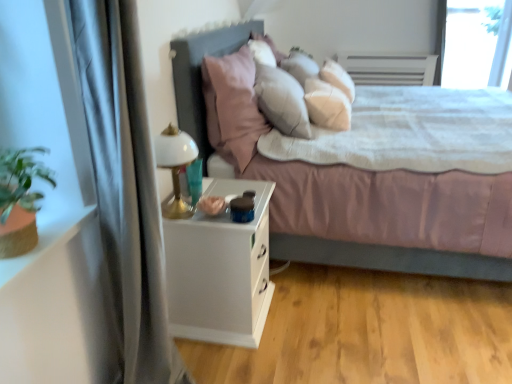
What are the coordinates of `space that is in front of white matte nightstand at lower left` in the screenshot? It's located at (243, 360).